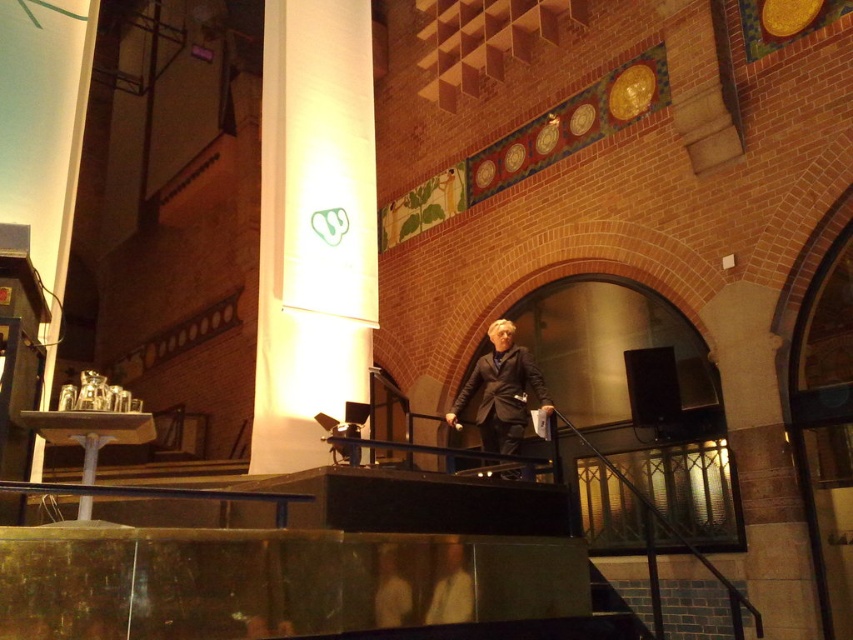
Who is positioned more to the right, dark gray suit at center or light beige suit at center?

From the viewer's perspective, dark gray suit at center appears more on the right side.

Does dark gray suit at center appear over light beige suit at center?

Correct, dark gray suit at center is located above light beige suit at center.

The height and width of the screenshot is (640, 853). What are the coordinates of `dark gray suit at center` in the screenshot? It's located at tap(502, 392).

Can you confirm if white paper at center is wider than dark gray suit at center?

Yes.

Which of these two, white paper at center or dark gray suit at center, stands shorter?

With less height is dark gray suit at center.

Where is `white paper at center`? white paper at center is located at coordinates (312, 227).

Locate an element on the screen. white paper at center is located at coordinates (312, 227).

Is white paper at center wider than light brown leather jacket at center?

Yes, white paper at center is wider than light brown leather jacket at center.

Is white paper at center behind light brown leather jacket at center?

Yes, white paper at center is further from the viewer.

Measure the distance between white paper at center and camera.

A distance of 15.93 feet exists between white paper at center and camera.

The image size is (853, 640). Find the location of `white paper at center`. white paper at center is located at coordinates (312, 227).